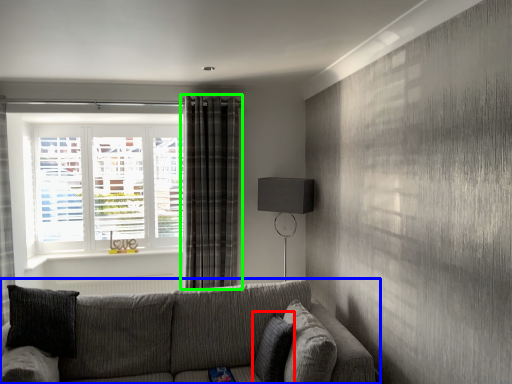
Question: Considering the real-world distances, which object is closest to pillow (highlighted by a red box)? studio couch (highlighted by a blue box) or curtain (highlighted by a green box).

Choices:
 (A) studio couch
 (B) curtain

Answer: (A)